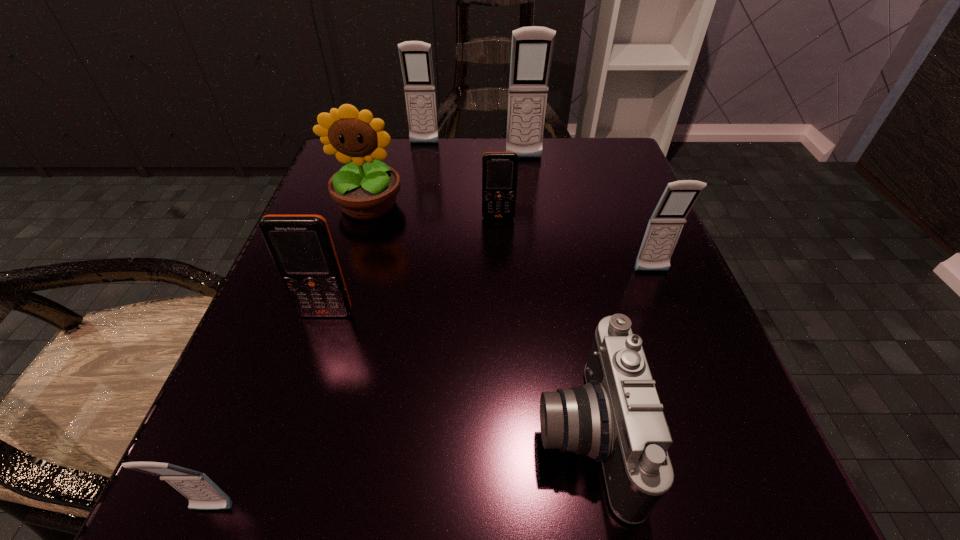
Identify the location of vacant space located 0.090m on the front-facing side of the camera. This screenshot has width=960, height=540. (463, 434).

The width and height of the screenshot is (960, 540). I want to click on free location located on the front-facing side of the camera, so click(x=371, y=434).

Image resolution: width=960 pixels, height=540 pixels. In order to click on blank space located on the front-facing side of the camera in this screenshot , I will do `click(210, 434)`.

Where is `sunflower that is at the far edge`? The image size is (960, 540). sunflower that is at the far edge is located at coordinates (364, 191).

This screenshot has width=960, height=540. I want to click on cellular telephone present at the near edge, so click(203, 494).

Image resolution: width=960 pixels, height=540 pixels. Find the location of `camera that is positioned at the near edge`. camera that is positioned at the near edge is located at coordinates (616, 418).

Image resolution: width=960 pixels, height=540 pixels. Find the location of `sunflower at the left edge`. sunflower at the left edge is located at coordinates (364, 191).

What are the coordinates of `cellular telephone present at the right edge` in the screenshot? It's located at point(666,223).

This screenshot has height=540, width=960. In order to click on camera situated at the right edge in this screenshot , I will do `click(616, 418)`.

I want to click on object that is at the far left corner, so click(364, 191).